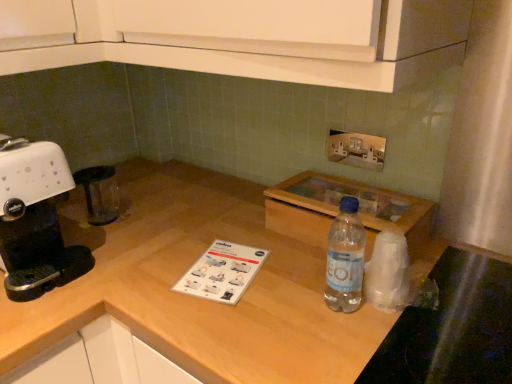
Identify the location of blank space situated above wooden at center (from a real-world perspective). (219, 243).